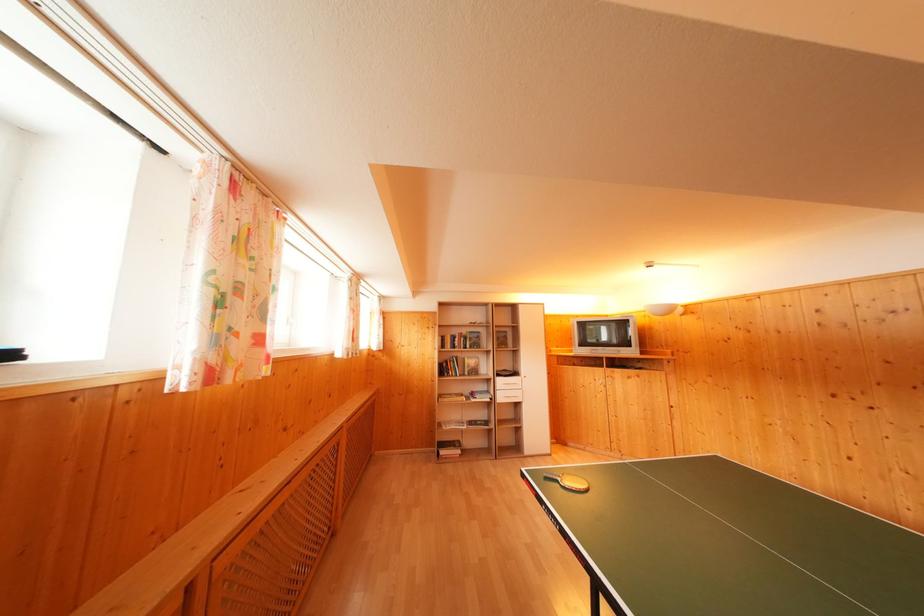
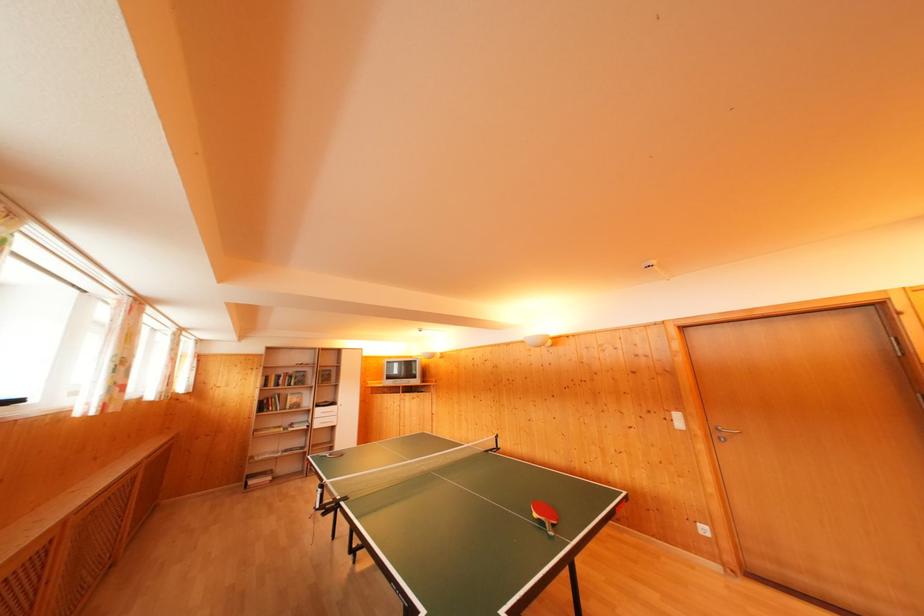
Find the pixel in the second image that matches the point at 505,386 in the first image.

(322, 416)